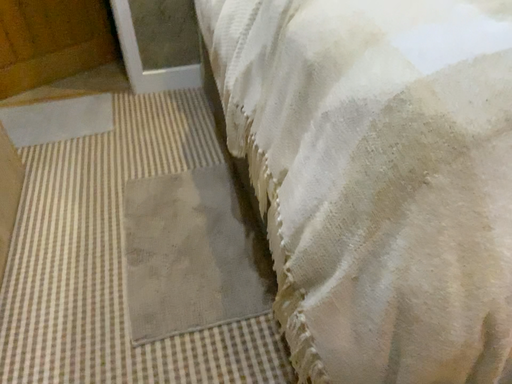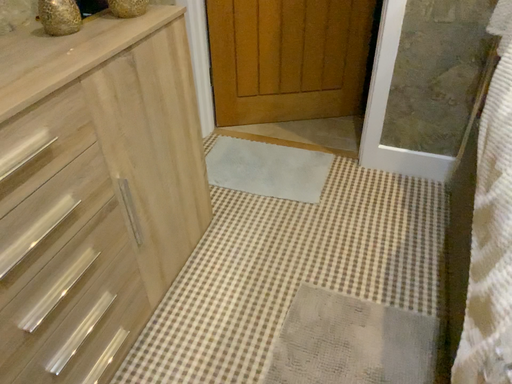
Question: Which way did the camera rotate in the video?

Choices:
 (A) rotated upward
 (B) rotated downward

Answer: (A)